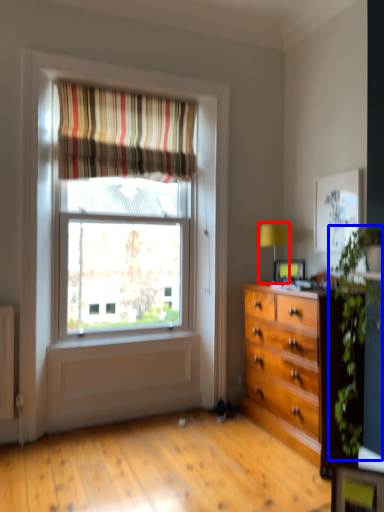
Question: Which object appears closest to the camera in this image, table lamp (highlighted by a red box) or plant (highlighted by a blue box)?

Choices:
 (A) table lamp
 (B) plant

Answer: (B)